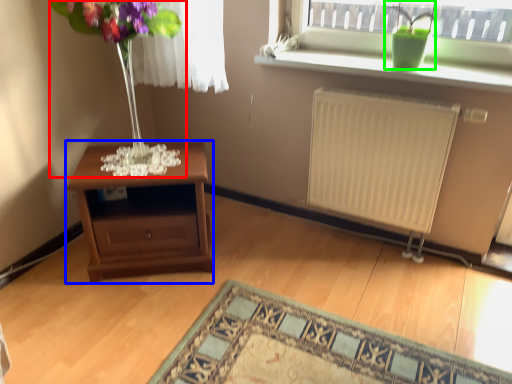
Question: Which object is positioned closest to bouquet (highlighted by a red box)? Select from table (highlighted by a blue box) and houseplant (highlighted by a green box).

Choices:
 (A) table
 (B) houseplant

Answer: (A)